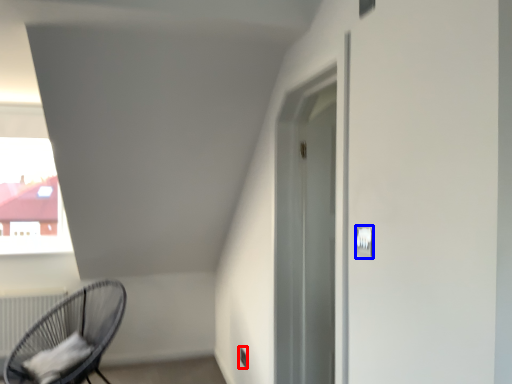
Question: Which object is further to the camera taking this photo, electric outlet (highlighted by a red box) or light switch (highlighted by a blue box)?

Choices:
 (A) electric outlet
 (B) light switch

Answer: (A)